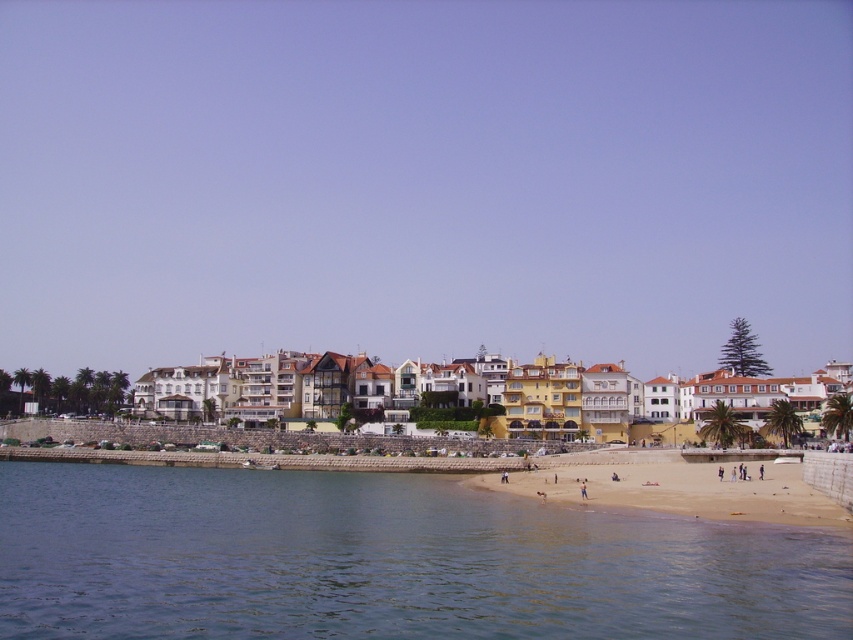
Question: Does clear blue water at lower left come in front of light brown sand at lower center?

Choices:
 (A) no
 (B) yes

Answer: (B)

Question: Which object appears farthest from the camera in this image?

Choices:
 (A) light brown sand at lower center
 (B) clear blue water at lower left

Answer: (A)

Question: Does clear blue water at lower left have a smaller size compared to light brown sand at lower center?

Choices:
 (A) no
 (B) yes

Answer: (A)

Question: Which point appears farthest from the camera in this image?

Choices:
 (A) (634, 452)
 (B) (386, 564)

Answer: (A)

Question: Does clear blue water at lower left appear on the left side of light brown sand at lower center?

Choices:
 (A) yes
 (B) no

Answer: (A)